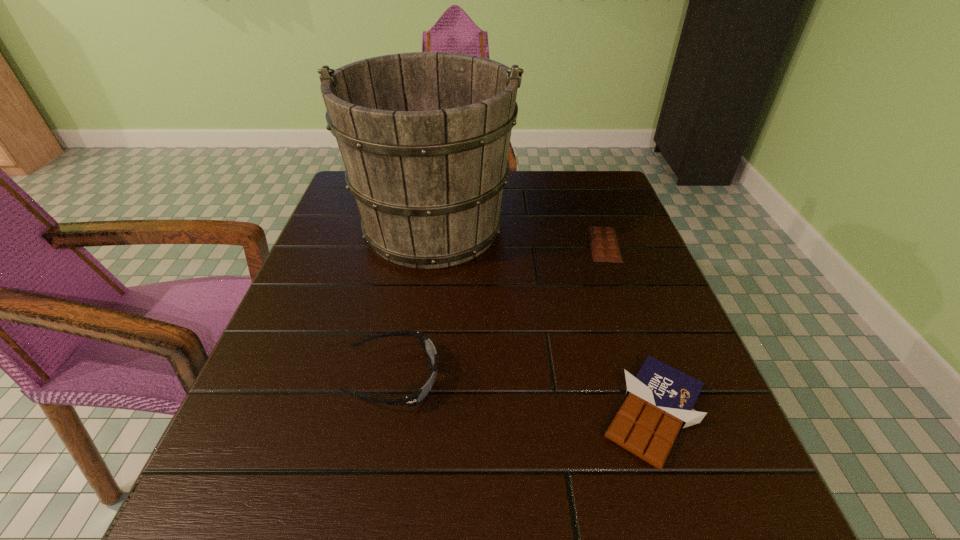
Select which object appears as the closest to the taller chocolate bar. Please provide its 2D coordinates. Your answer should be formatted as a tuple, i.e. [(x, y)], where the tuple contains the x and y coordinates of a point satisfying the conditions above.

[(424, 136)]

Locate an element on the screen. vacant space that satisfies the following two spatial constraints: 1. on the lenses of the third shortest object; 2. on the right side of the nearer chocolate bar is located at coordinates (388, 412).

The image size is (960, 540). Identify the location of free spot that satisfies the following two spatial constraints: 1. on the lenses of the sunglasses; 2. on the left side of the nearer chocolate bar. (388, 412).